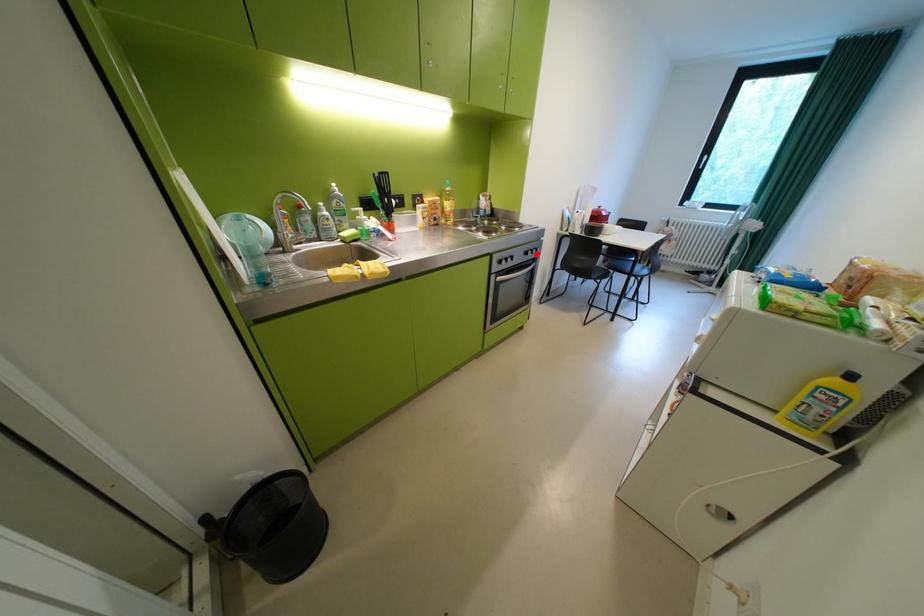
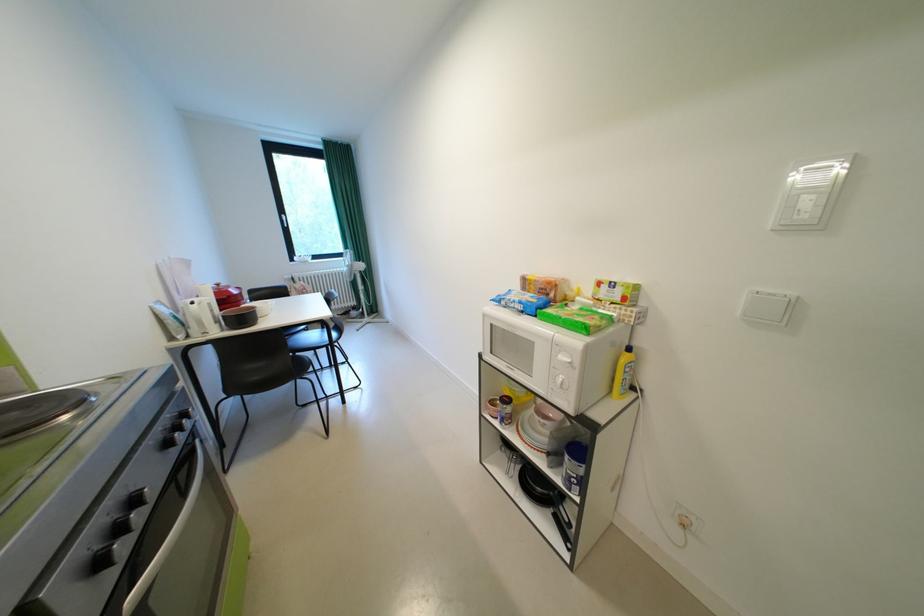
Find the pixel in the second image that matches the highlighted location in the first image.

(176, 446)